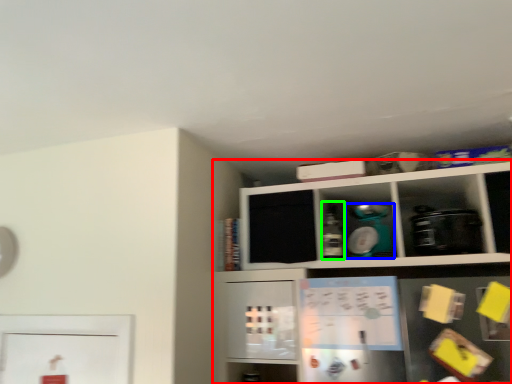
Question: Which object is the farthest from shelf (highlighted by a red box)? Choose among these: appliance (highlighted by a blue box) or bottle (highlighted by a green box).

Choices:
 (A) appliance
 (B) bottle

Answer: (B)